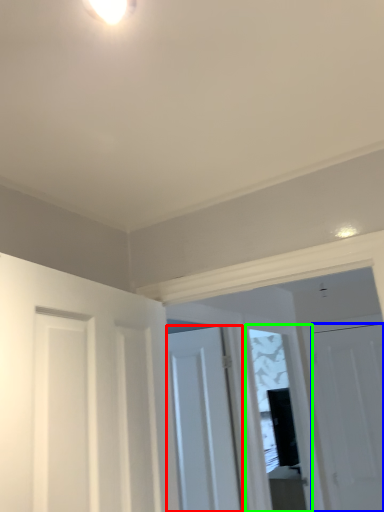
Question: Estimate the real-world distances between objects in this image. Which object is closer to door (highlighted by a red box), door (highlighted by a blue box) or window (highlighted by a green box)?

Choices:
 (A) door
 (B) window

Answer: (A)